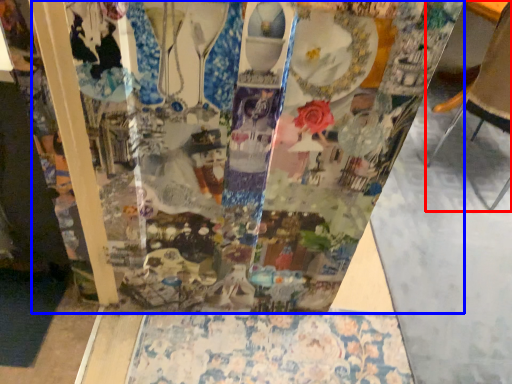
Question: Which point is further to the camera, furniture (highlighted by a red box) or glass box (highlighted by a blue box)?

Choices:
 (A) furniture
 (B) glass box

Answer: (A)